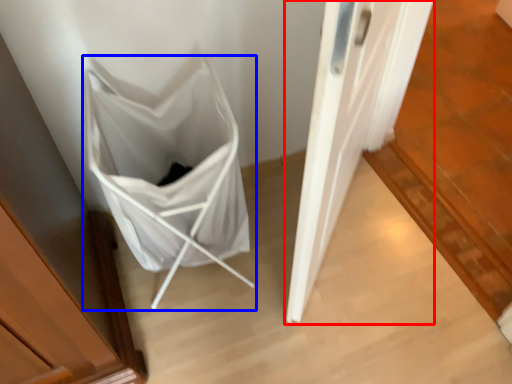
Question: Which object is further to the camera taking this photo, door (highlighted by a red box) or folding chair (highlighted by a blue box)?

Choices:
 (A) door
 (B) folding chair

Answer: (B)